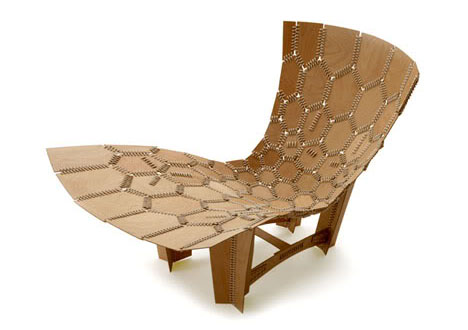
Where is `edge of chair`? This screenshot has height=330, width=468. edge of chair is located at coordinates (102, 215), (373, 39).